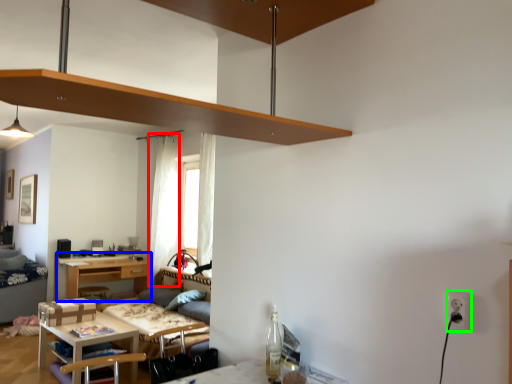
Question: Which is nearer to the curtain (highlighted by a red box)? desk (highlighted by a blue box) or electric outlet (highlighted by a green box).

Choices:
 (A) desk
 (B) electric outlet

Answer: (A)